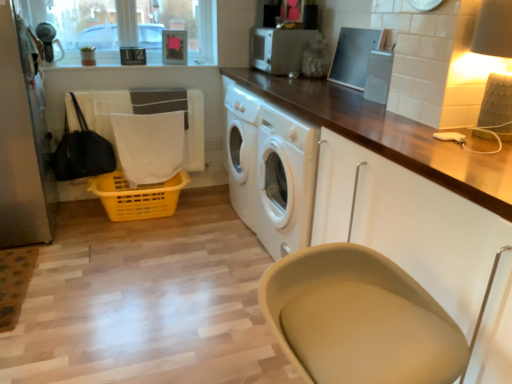
Find the location of a particular element. vacant space situated on the left part of clear plastic container at upper center, positioned as the 1th appliance in right-to-left order is located at coordinates (343, 101).